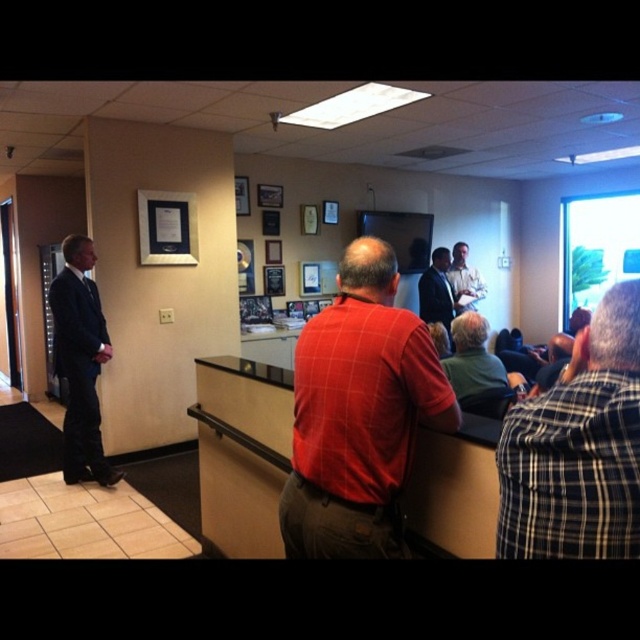
You are a photographer standing 10 feet away from the two people wearing matte black clothing. You want to take a photo of them both clearly in the frame. Considering the distance between the matte black suit at center and the matte black shirt at center, will you be able to focus on both subjects simultaneously?

The distance between the matte black suit at center and the matte black shirt at center is only 12.40 inches, which is within the typical depth of field for a camera at 10 feet. Therefore, you should be able to focus on both subjects simultaneously.